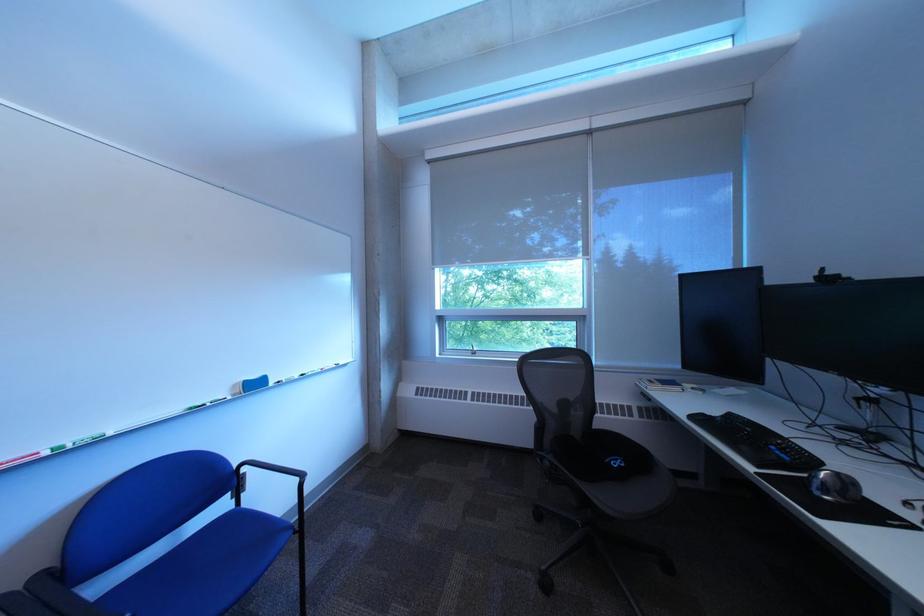
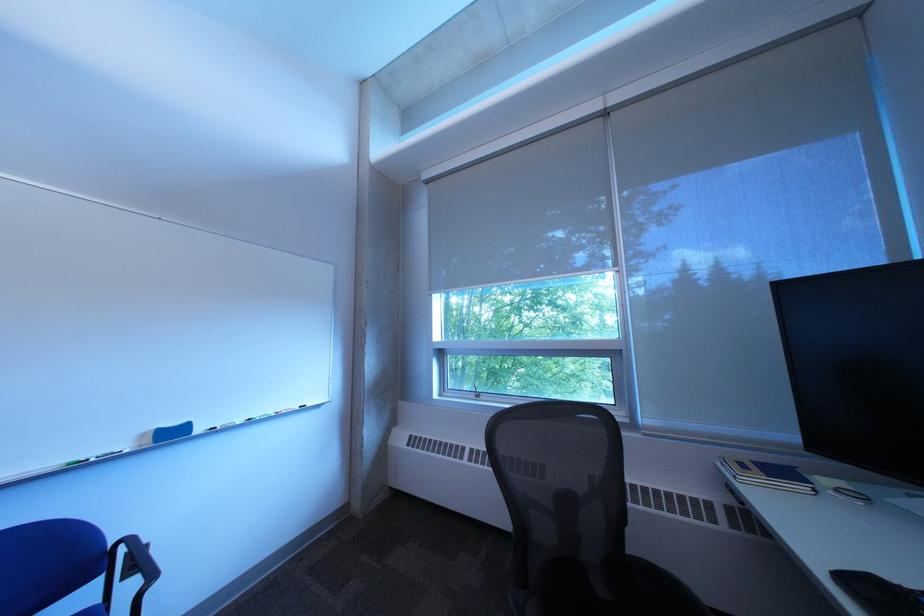
Question: The images are taken continuously from a first-person perspective. In which direction is your viewpoint rotating?

Choices:
 (A) Left
 (B) Right
 (C) Up
 (D) Down

Answer: (A)